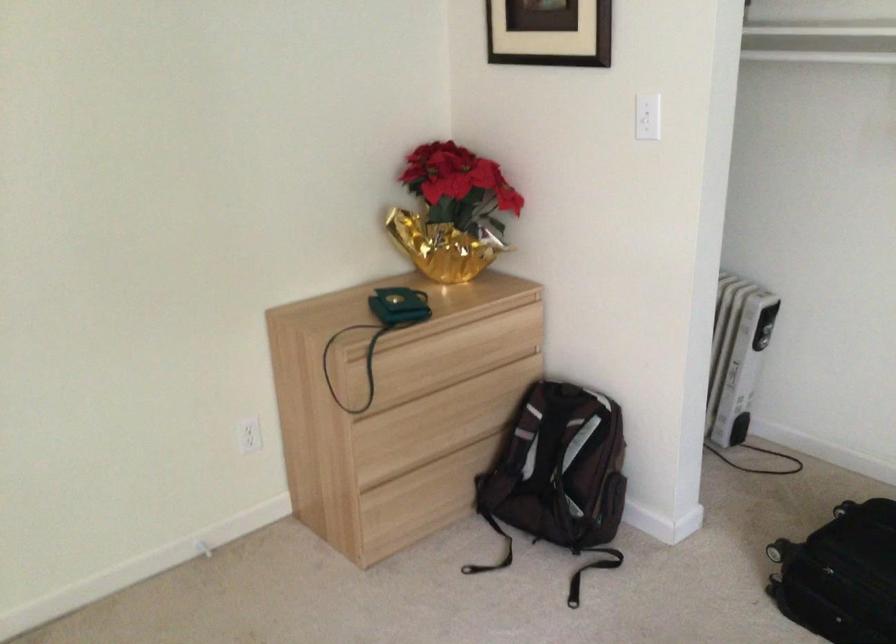
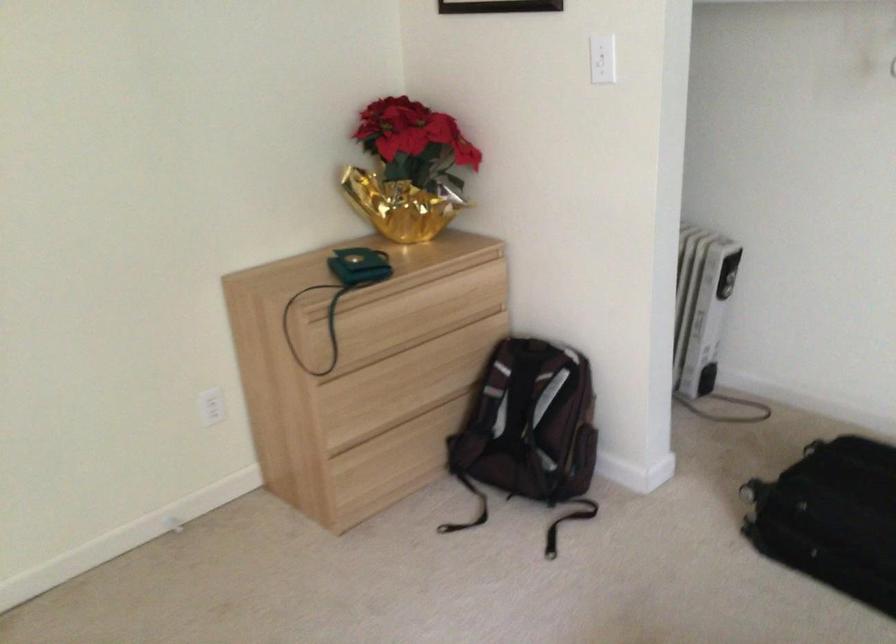
Where in the second image is the point corresponding to the point at 398,307 from the first image?

(358, 267)